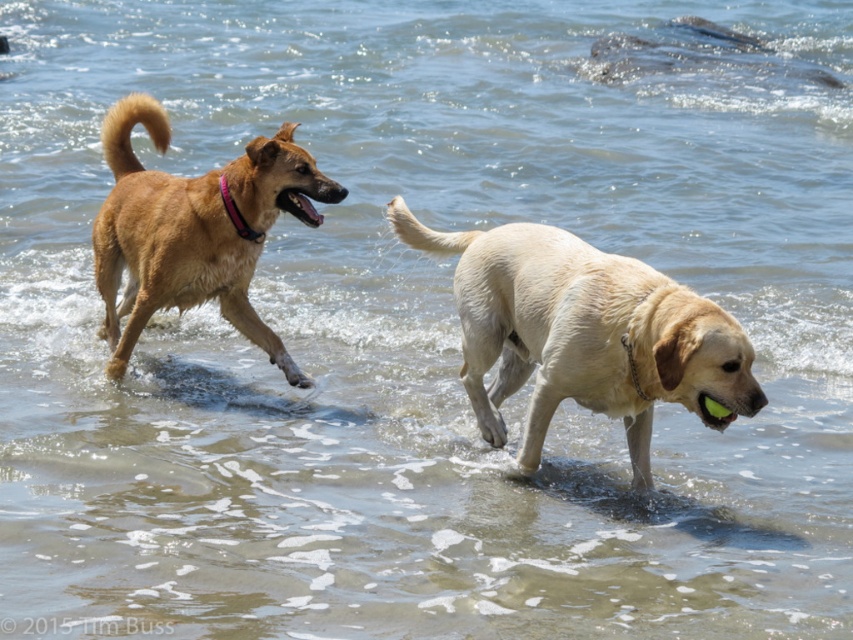
Does golden fur dog at center lie in front of brown furry dog at left?

Yes.

Between point (505, 378) and point (223, 312), which one is positioned in front?

Point (505, 378) is in front.

The height and width of the screenshot is (640, 853). Find the location of `golden fur dog at center`. golden fur dog at center is located at coordinates [583, 333].